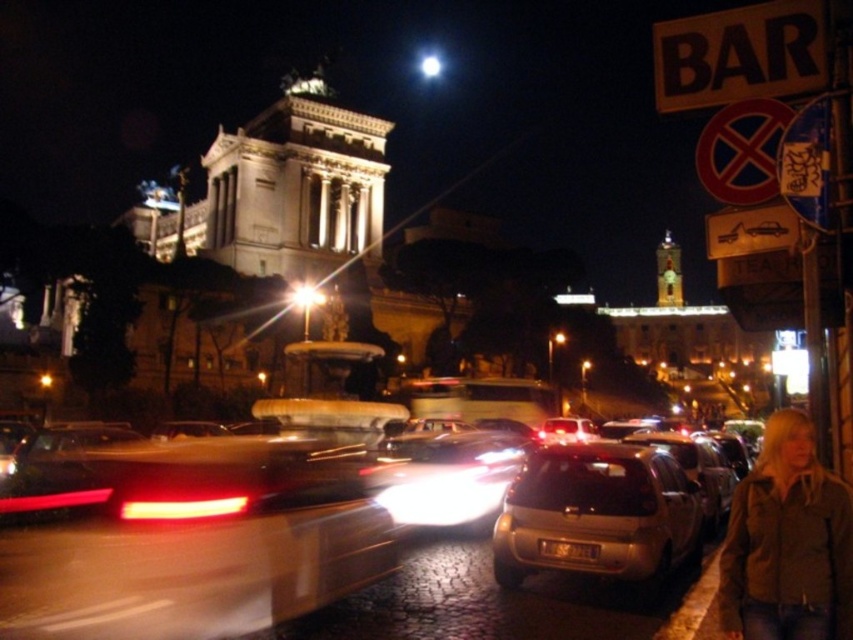
You are a pedestrian standing on the sidewalk in the scene. You see a brown leather jacket at lower right and a black plastic sign at upper right. Which object is nearer to you?

The brown leather jacket at lower right is closer to the viewer than the black plastic sign at upper right.